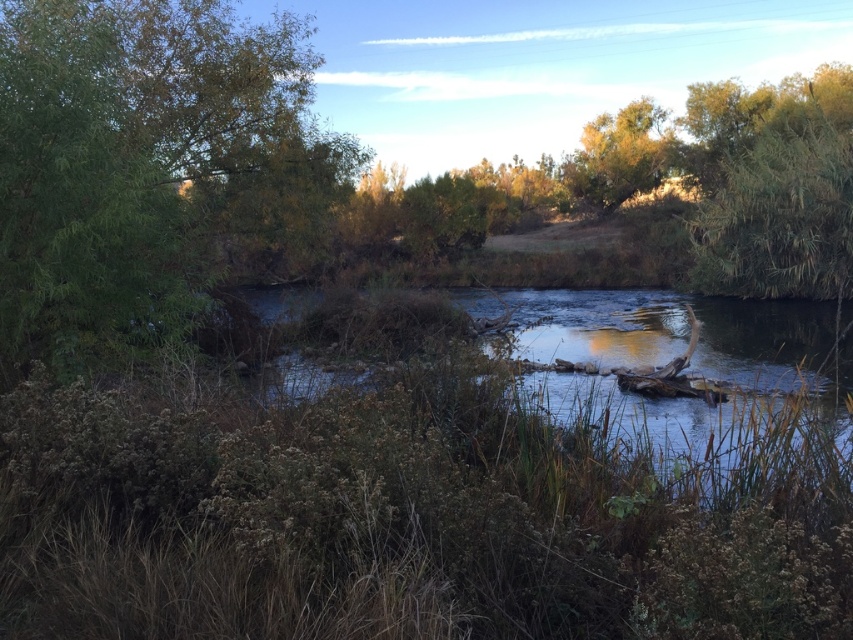
Question: Is green leafy tree at left in front of smooth brown water at center?

Choices:
 (A) yes
 (B) no

Answer: (B)

Question: Can you confirm if smooth brown water at center is smaller than green leafy tree at upper right?

Choices:
 (A) yes
 (B) no

Answer: (B)

Question: Which of the following is the farthest from the observer?

Choices:
 (A) (360, 154)
 (B) (730, 349)

Answer: (A)

Question: Considering the real-world distances, which object is farthest from the green leafy tree at left?

Choices:
 (A) green leafy tree at upper right
 (B) smooth brown water at center

Answer: (A)

Question: Estimate the real-world distances between objects in this image. Which object is farther from the green leafy tree at upper right?

Choices:
 (A) smooth brown water at center
 (B) green leafy tree at left

Answer: (B)

Question: Is green leafy tree at left positioned before green leafy tree at upper right?

Choices:
 (A) no
 (B) yes

Answer: (B)